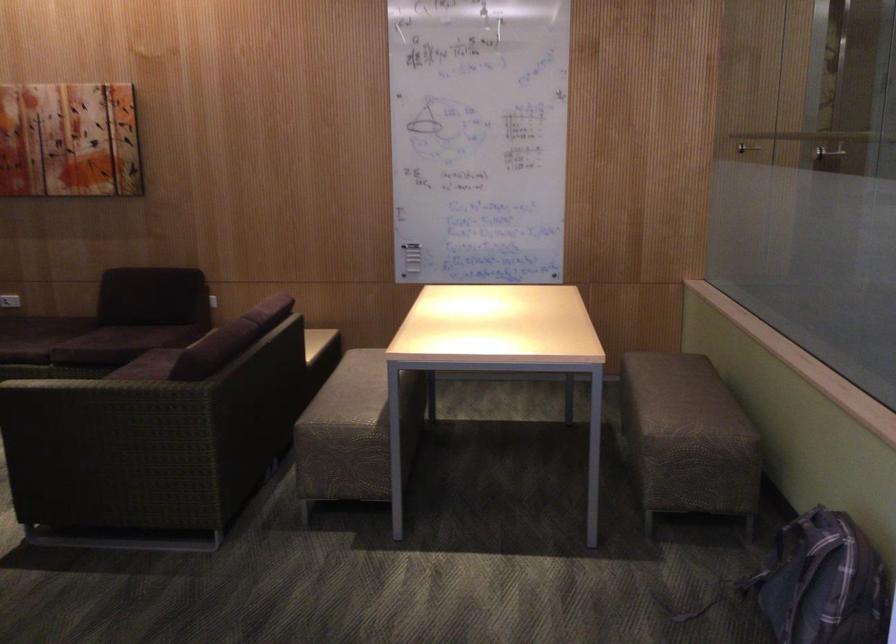
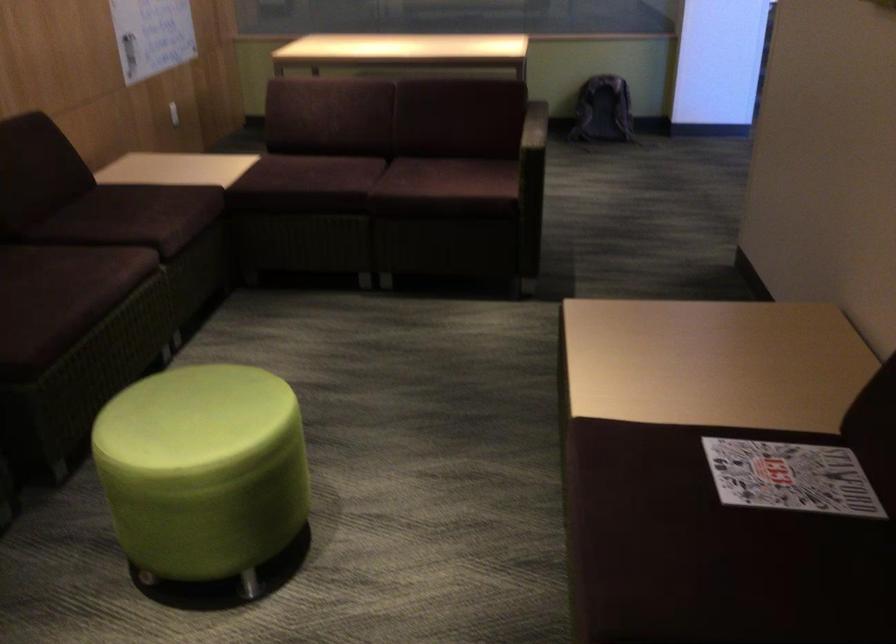
In the second image, find the point that corresponds to (131,377) in the first image.

(371, 185)